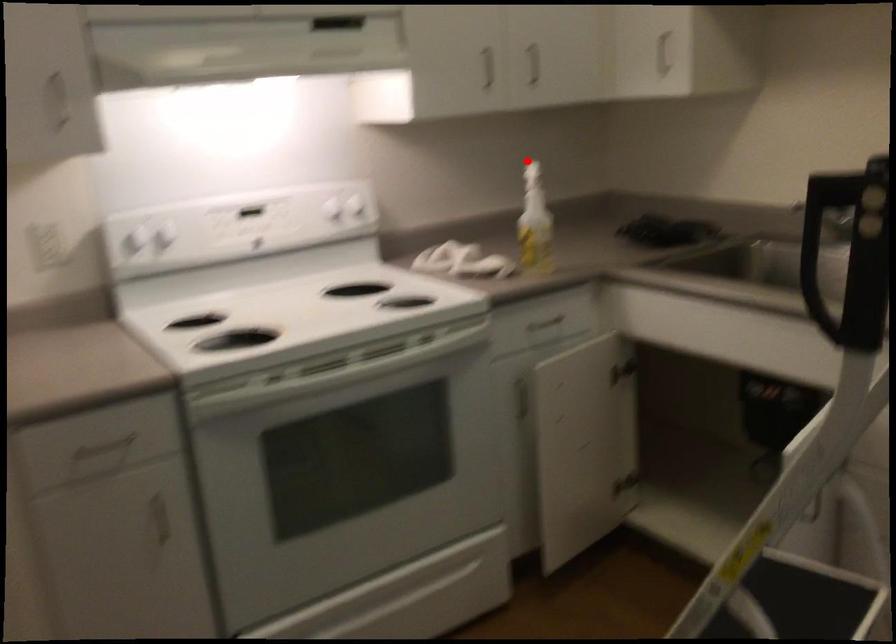
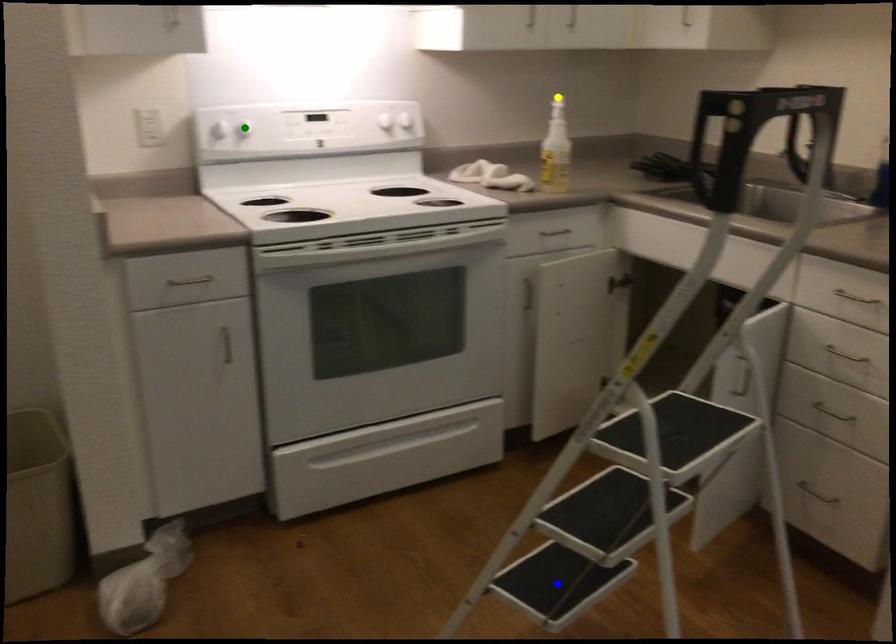
Question: I am providing you with two images of the same scene from different viewpoints. A red point is marked on the first image. You are given multiple points on the second image. In image 2, which mark is for the same physical point as the one in image 1?

Choices:
 (A) blue point
 (B) yellow point
 (C) green point

Answer: (B)